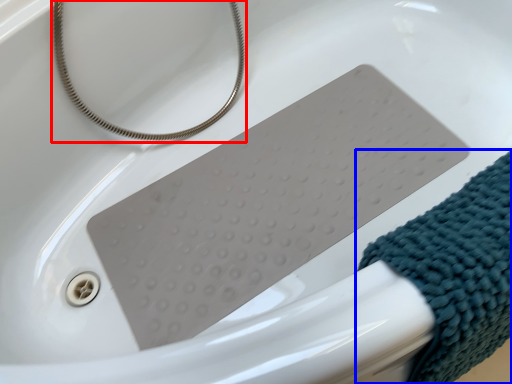
Question: Which point is closer to the camera, string (highlighted by a red box) or wrap (highlighted by a blue box)?

Choices:
 (A) string
 (B) wrap

Answer: (B)